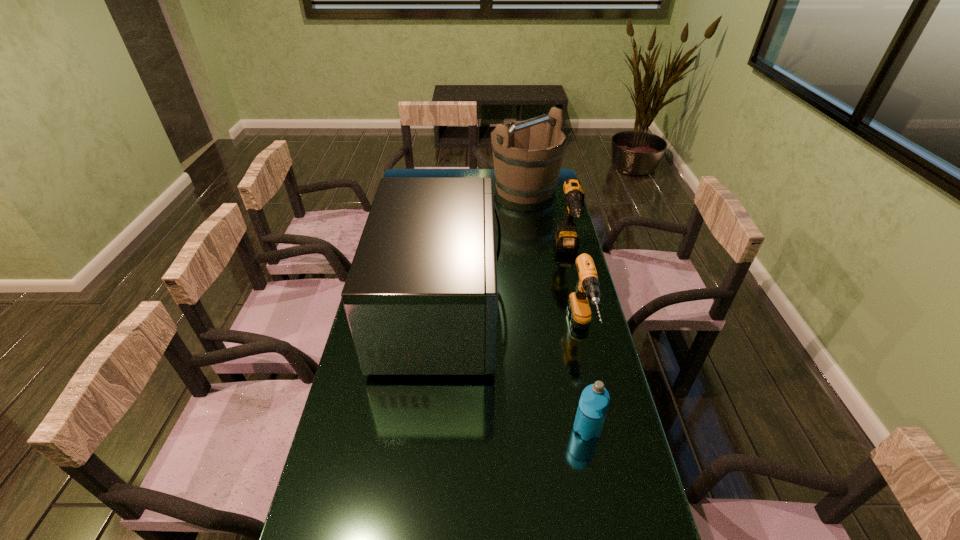
Find the location of a particular element. Image resolution: width=960 pixels, height=540 pixels. free point between the nearer drill and the farthest object is located at coordinates (554, 260).

Identify the location of free area in between the nearest object and the nearer drill. (585, 380).

The width and height of the screenshot is (960, 540). What are the coordinates of `empty location between the thermos bottle and the nearer drill` in the screenshot? It's located at (585, 380).

Find the location of a particular element. Image resolution: width=960 pixels, height=540 pixels. free spot between the thermos bottle and the third shortest object is located at coordinates (577, 340).

Point out which object is positioned as the third nearest to the farther drill. Please provide its 2D coordinates. Your answer should be formatted as a tuple, i.e. [(x, y)], where the tuple contains the x and y coordinates of a point satisfying the conditions above.

[(421, 296)]

In order to click on object that ranks as the fourth closest to the nearer drill in this screenshot , I will do `click(523, 176)`.

At what (x,y) coordinates should I click in order to perform the action: click on free spot that satisfies the following two spatial constraints: 1. on the front-facing side of the thermos bottle; 2. on the left side of the microwave oven. Please return your answer as a coordinate pair (x, y). The width and height of the screenshot is (960, 540). Looking at the image, I should click on (427, 429).

At what (x,y) coordinates should I click in order to perform the action: click on vacant space that satisfies the following two spatial constraints: 1. on the front-facing side of the microwave oven; 2. on the right side of the thermos bottle. Please return your answer as a coordinate pair (x, y). The height and width of the screenshot is (540, 960). Looking at the image, I should click on (427, 429).